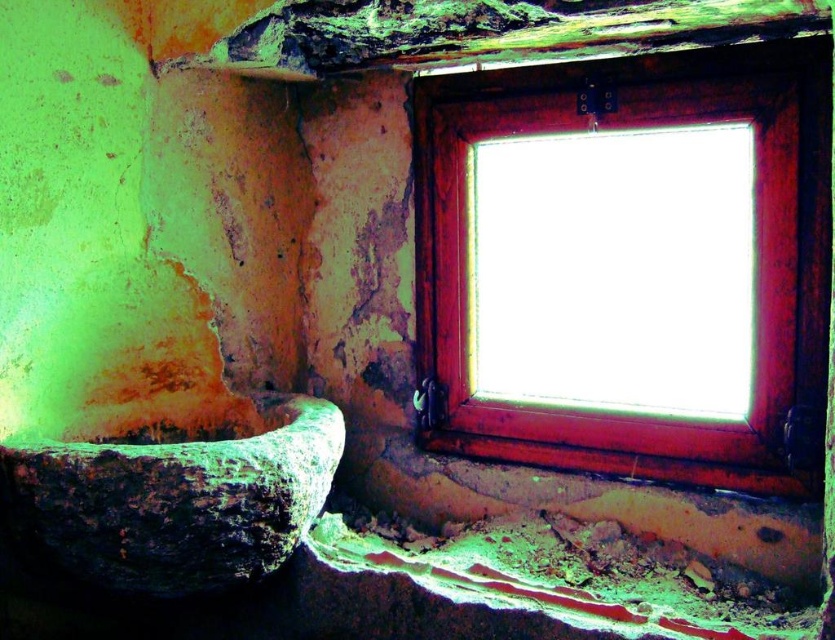
Question: Among these objects, which one is nearest to the camera?

Choices:
 (A) rusty stone bath at lower left
 (B) rusty wood window at upper right

Answer: (A)

Question: Can you confirm if rusty wood window at upper right is positioned to the right of rusty stone bath at lower left?

Choices:
 (A) no
 (B) yes

Answer: (B)

Question: Is rusty wood window at upper right behind rusty stone bath at lower left?

Choices:
 (A) no
 (B) yes

Answer: (B)

Question: Which point is farther to the camera?

Choices:
 (A) (606, 442)
 (B) (244, 429)

Answer: (B)

Question: Which point appears closest to the camera in this image?

Choices:
 (A) (468, 356)
 (B) (337, 412)

Answer: (B)

Question: Does rusty wood window at upper right have a smaller size compared to rusty stone bath at lower left?

Choices:
 (A) yes
 (B) no

Answer: (B)